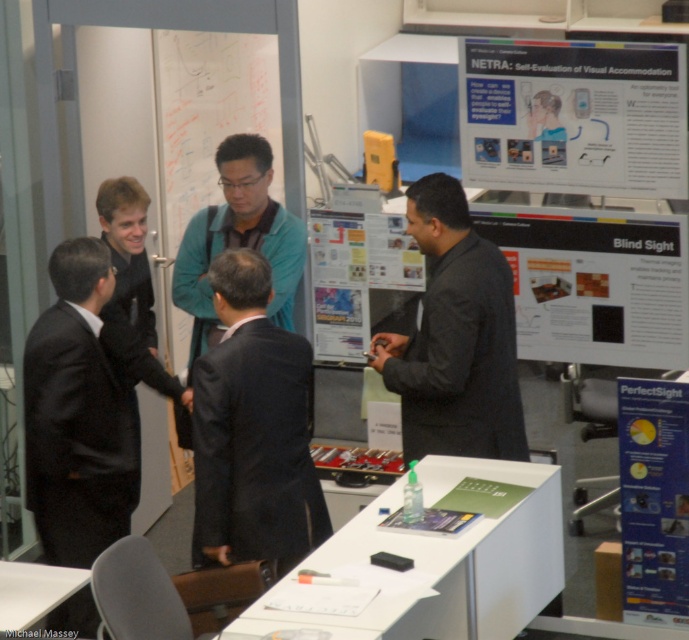
Which is in front, point (570, 307) or point (681, 182)?

Point (681, 182) is in front.

What are the coordinates of `white paper poster at center` in the screenshot? It's located at (596, 284).

I want to click on white paper poster at center, so click(x=596, y=284).

Consider the image. Between white paper at upper right and dark gray suit at center, which one is positioned lower?

dark gray suit at center

Does point (495, 177) come farther from viewer compared to point (438, 449)?

Yes, it is.

Where is `white paper at upper right`? The image size is (689, 640). white paper at upper right is located at coordinates (573, 116).

Looking at this image, is black suit at center below white paper at lower right?

Actually, black suit at center is above white paper at lower right.

The image size is (689, 640). I want to click on black suit at center, so point(251,429).